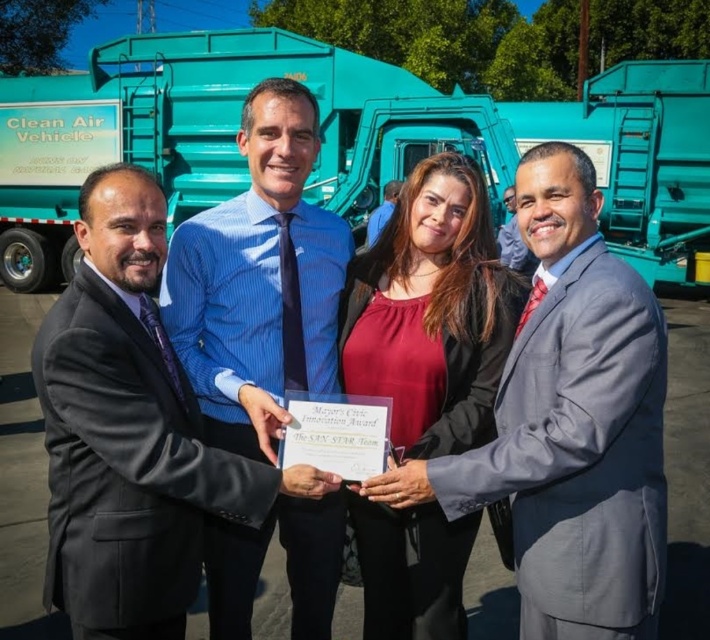
Locate an element on the screen. This screenshot has height=640, width=710. white paper certificate at center is located at coordinates (337, 433).

Can you confirm if white paper certificate at center is thinner than matte blue shirt at center?

Yes.

Find the location of a particular element. Image resolution: width=710 pixels, height=640 pixels. white paper certificate at center is located at coordinates (337, 433).

Locate an element on the screen. The height and width of the screenshot is (640, 710). white paper certificate at center is located at coordinates click(337, 433).

Who is more forward, (376, 566) or (510, 227)?

Point (376, 566) is more forward.

Does matte red blouse at center lie in front of gray suit at center?

Yes, it is in front of gray suit at center.

Locate an element on the screen. This screenshot has height=640, width=710. matte red blouse at center is located at coordinates (431, 312).

At what (x,y) coordinates should I click in order to perform the action: click on matte red blouse at center. Please return your answer as a coordinate pair (x, y). This screenshot has height=640, width=710. Looking at the image, I should click on (431, 312).

Who is more distant from viewer, (305, 506) or (513, 323)?

Positioned behind is point (305, 506).

Between point (334, 529) and point (410, 188), which one is positioned behind?

The point (334, 529) is behind.

This screenshot has height=640, width=710. I want to click on blue striped shirt at center, so click(258, 280).